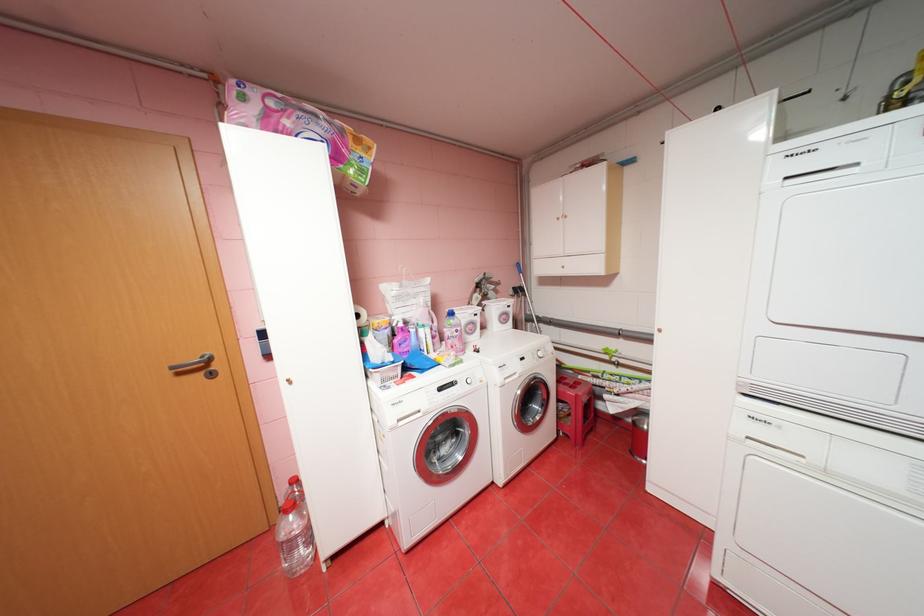
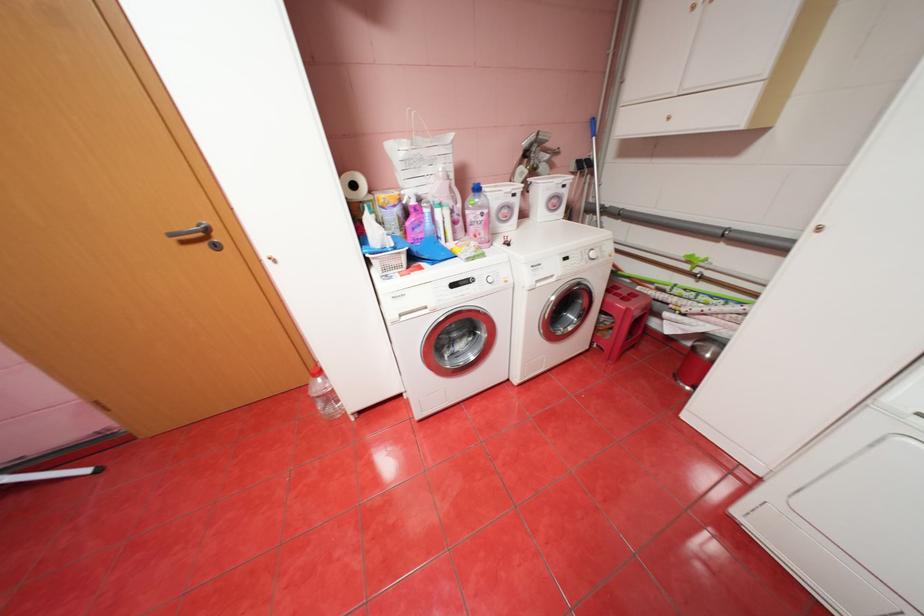
Find the pixel in the second image that matches point (457, 341) in the first image.

(480, 228)